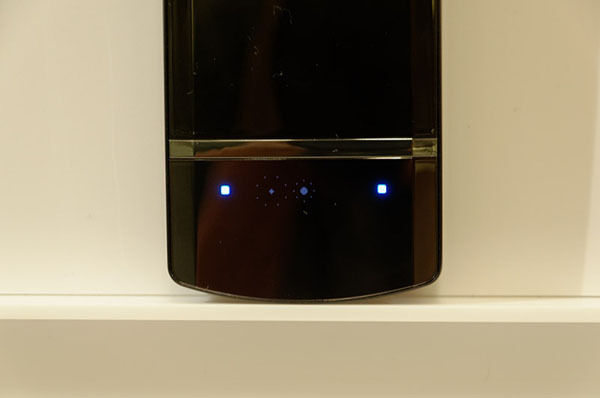
Where is `light brown wall`? light brown wall is located at coordinates point(547,98).